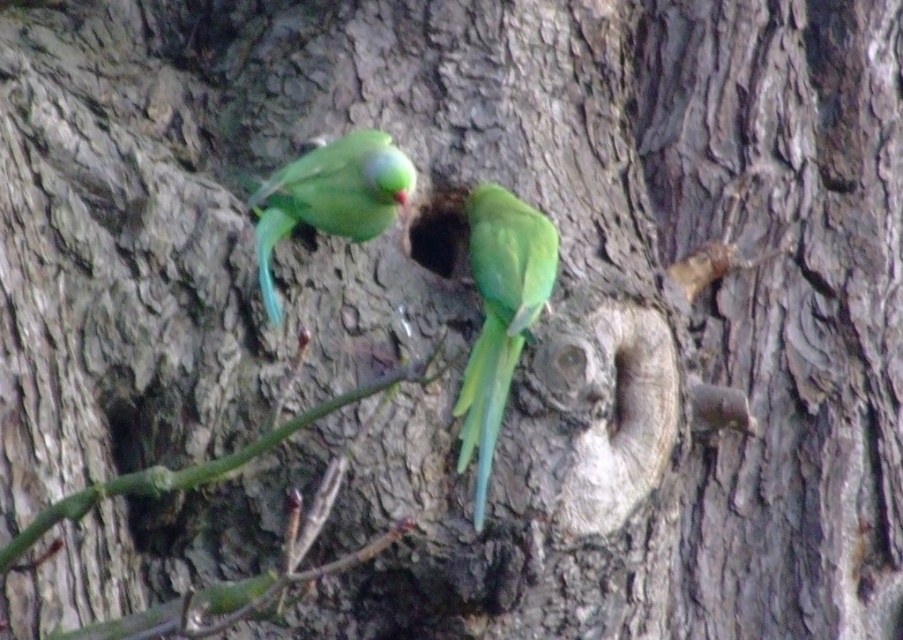
Question: Does green matte parrot at center have a smaller size compared to green matte branch at lower left?

Choices:
 (A) yes
 (B) no

Answer: (A)

Question: Which of the following is the closest to the observer?

Choices:
 (A) green matte parrot at center
 (B) green glossy parrot at upper center
 (C) green matte branch at lower left

Answer: (C)

Question: Does green glossy parrot at upper center lie behind green matte branch at lower left?

Choices:
 (A) yes
 (B) no

Answer: (A)

Question: Which of the following is the closest to the observer?

Choices:
 (A) green matte branch at lower left
 (B) green glossy parrot at upper center

Answer: (A)

Question: Where is green glossy parrot at upper center located in relation to green matte branch at lower left in the image?

Choices:
 (A) left
 (B) right

Answer: (B)

Question: Among these objects, which one is nearest to the camera?

Choices:
 (A) green matte branch at lower left
 (B) green glossy parrot at upper center
 (C) green matte parrot at center

Answer: (A)